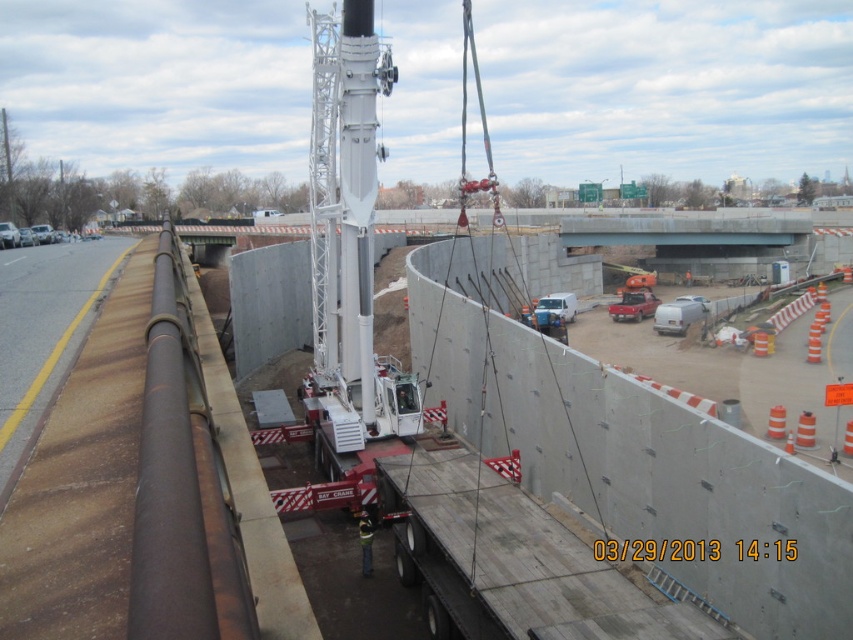
Who is more forward, (111, 561) or (115, 280)?

Positioned in front is point (111, 561).

Is concrete wall at center closer to camera compared to brown asphalt highway at left?

Yes, concrete wall at center is closer to the viewer.

At what (x,y) coordinates should I click in order to perform the action: click on concrete wall at center. Please return your answer as a coordinate pair (x, y). This screenshot has width=853, height=640. Looking at the image, I should click on (140, 492).

I want to click on concrete wall at center, so click(140, 492).

What do you see at coordinates (140, 492) in the screenshot?
I see `concrete wall at center` at bounding box center [140, 492].

Find the location of `concrete wall at center`. concrete wall at center is located at coordinates (140, 492).

What are the coordinates of `concrete wall at center` in the screenshot? It's located at (140, 492).

Based on the photo, is brown asphalt highway at left shorter than reflective yellow safety vest at center?

No, brown asphalt highway at left is not shorter than reflective yellow safety vest at center.

Image resolution: width=853 pixels, height=640 pixels. What do you see at coordinates (45, 333) in the screenshot?
I see `brown asphalt highway at left` at bounding box center [45, 333].

Is point (38, 301) positioned behind point (368, 522)?

No, (38, 301) is closer to viewer.

Find the location of a particular element. The image size is (853, 640). brown asphalt highway at left is located at coordinates (45, 333).